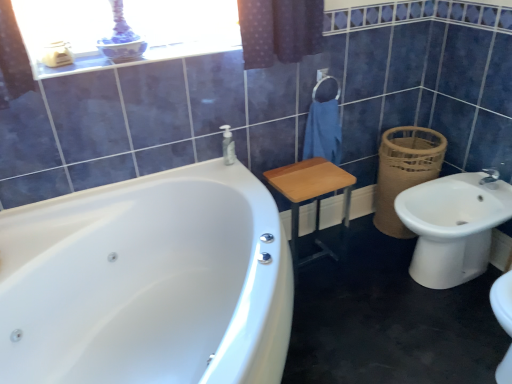
At what (x,y) coordinates should I click in order to perform the action: click on free space in front of clear plastic soap dispenser at upper center. Please return your answer as a coordinate pair (x, y). The image size is (512, 384). Looking at the image, I should click on (233, 174).